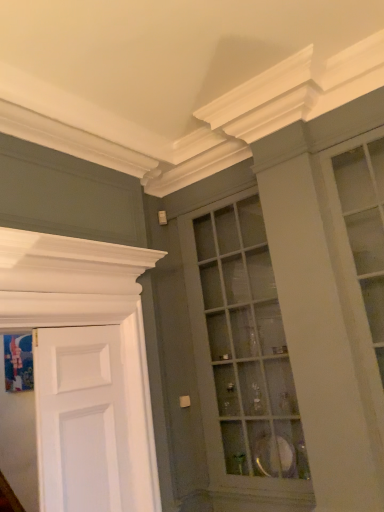
Question: Is white matte door at left aimed at matte glass cabinet at center?

Choices:
 (A) yes
 (B) no

Answer: (B)

Question: Is the surface of white matte door at left in direct contact with matte glass cabinet at center?

Choices:
 (A) no
 (B) yes

Answer: (A)

Question: Does white matte door at left have a smaller size compared to matte glass cabinet at center?

Choices:
 (A) no
 (B) yes

Answer: (B)

Question: Is matte glass cabinet at center inside white matte door at left?

Choices:
 (A) no
 (B) yes

Answer: (A)

Question: From the image's perspective, does white matte door at left appear lower than matte glass cabinet at center?

Choices:
 (A) yes
 (B) no

Answer: (A)

Question: Is white matte door at left to the right of matte glass cabinet at center from the viewer's perspective?

Choices:
 (A) no
 (B) yes

Answer: (A)

Question: Is the depth of matte glass cabinet at center less than that of white matte door at left?

Choices:
 (A) yes
 (B) no

Answer: (B)

Question: Is matte glass cabinet at center far away from white matte door at left?

Choices:
 (A) no
 (B) yes

Answer: (B)

Question: From a real-world perspective, does matte glass cabinet at center stand above white matte door at left?

Choices:
 (A) no
 (B) yes

Answer: (B)

Question: Can you confirm if matte glass cabinet at center is taller than white matte door at left?

Choices:
 (A) no
 (B) yes

Answer: (B)

Question: From the image's perspective, is matte glass cabinet at center below white matte door at left?

Choices:
 (A) no
 (B) yes

Answer: (A)

Question: From the image's perspective, would you say matte glass cabinet at center is positioned over white matte door at left?

Choices:
 (A) no
 (B) yes

Answer: (B)

Question: Is white matte door at left in front of or behind matte glass cabinet at center in the image?

Choices:
 (A) behind
 (B) front

Answer: (B)